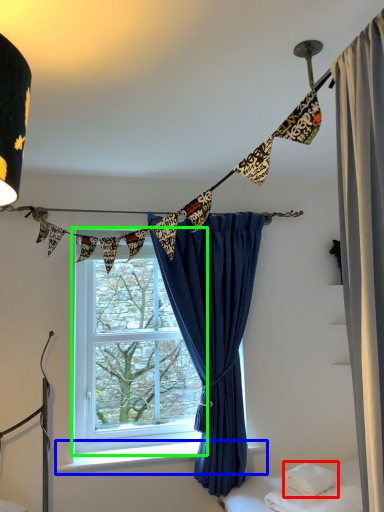
Question: Based on their relative distances, which object is farther from pillow (highlighted by a red box)? Choose from window sill (highlighted by a blue box) and window (highlighted by a green box).

Choices:
 (A) window sill
 (B) window

Answer: (B)